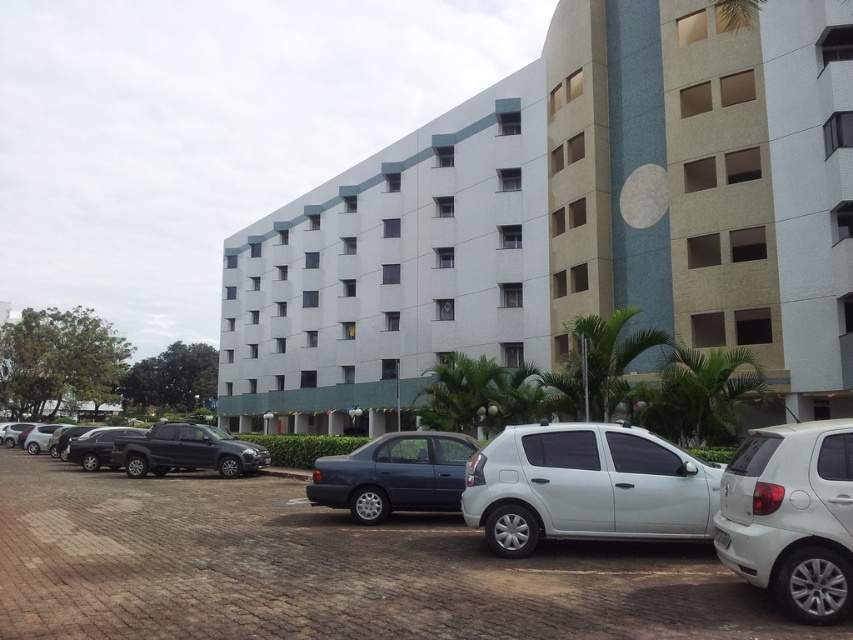
Can you confirm if satin dark blue sedan at center is thinner than shiny black sedan at left?

Yes, satin dark blue sedan at center is thinner than shiny black sedan at left.

Does satin dark blue sedan at center have a larger size compared to shiny black sedan at left?

Actually, satin dark blue sedan at center might be smaller than shiny black sedan at left.

Locate an element on the screen. This screenshot has width=853, height=640. satin dark blue sedan at center is located at coordinates (393, 474).

Where is `satin dark blue sedan at center`? Image resolution: width=853 pixels, height=640 pixels. satin dark blue sedan at center is located at coordinates (393, 474).

Who is positioned more to the left, white matte hatchback at center or matte black pickup truck at lower left?

matte black pickup truck at lower left is more to the left.

Does white matte hatchback at center lie behind matte black pickup truck at lower left?

No, white matte hatchback at center is closer to the viewer.

Does point (653, 474) come behind point (229, 442)?

No, (653, 474) is in front of (229, 442).

Locate an element on the screen. The image size is (853, 640). white matte hatchback at center is located at coordinates (585, 486).

Is satin dark blue sedan at center taller than matte black pickup truck at lower left?

In fact, satin dark blue sedan at center may be shorter than matte black pickup truck at lower left.

Between satin dark blue sedan at center and matte black pickup truck at lower left, which one has more height?

With more height is matte black pickup truck at lower left.

Where is `satin dark blue sedan at center`? This screenshot has height=640, width=853. satin dark blue sedan at center is located at coordinates (393, 474).

Identify the location of satin dark blue sedan at center. This screenshot has width=853, height=640. (393, 474).